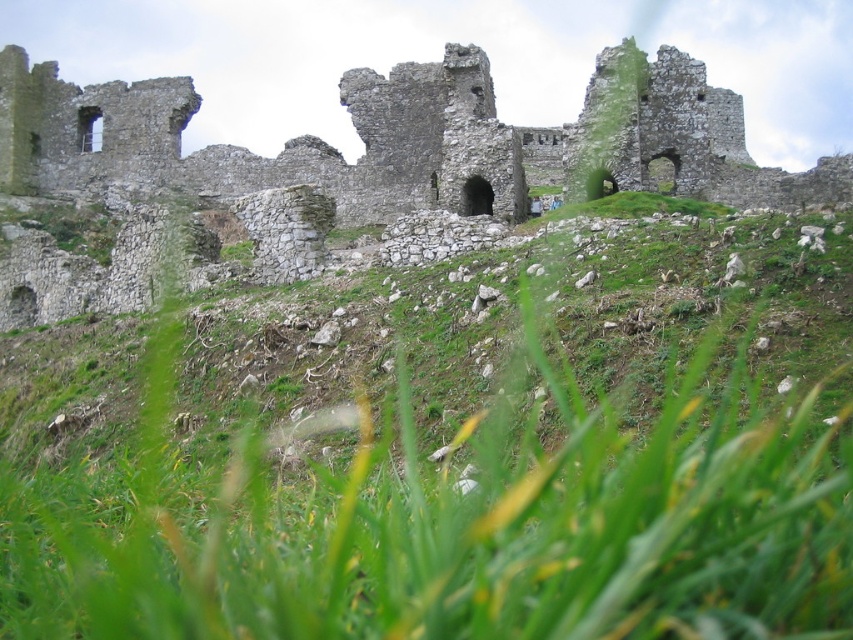
Question: Can you confirm if green grassy at center is thinner than stone ruins at upper center?

Choices:
 (A) no
 (B) yes

Answer: (B)

Question: Which point appears closest to the camera in this image?

Choices:
 (A) (639, 296)
 (B) (252, 176)

Answer: (A)

Question: Which point is closer to the camera taking this photo?

Choices:
 (A) (x=694, y=624)
 (B) (x=741, y=163)

Answer: (A)

Question: Is green grassy at center to the left of stone ruins at upper center from the viewer's perspective?

Choices:
 (A) no
 (B) yes

Answer: (B)

Question: Is green grassy at center above stone ruins at upper center?

Choices:
 (A) no
 (B) yes

Answer: (A)